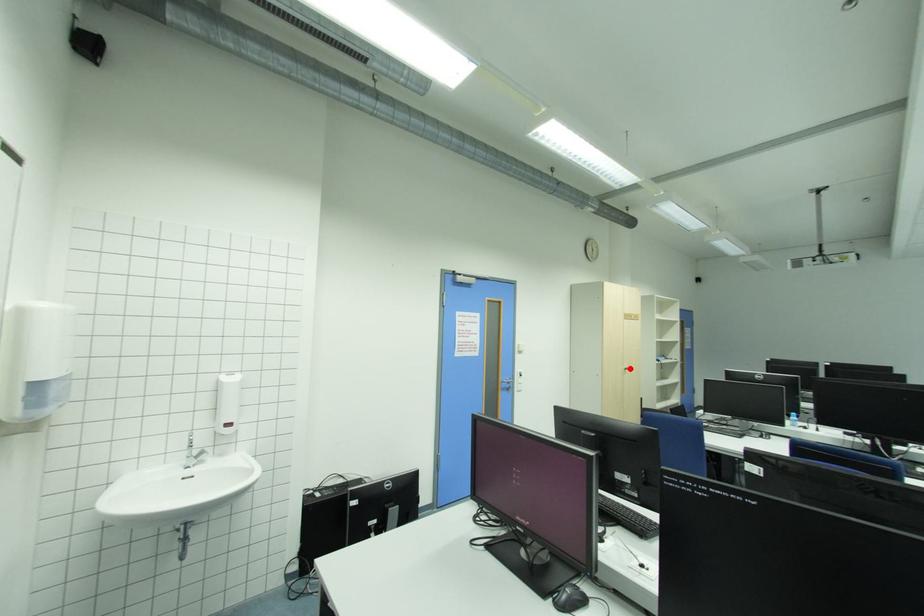
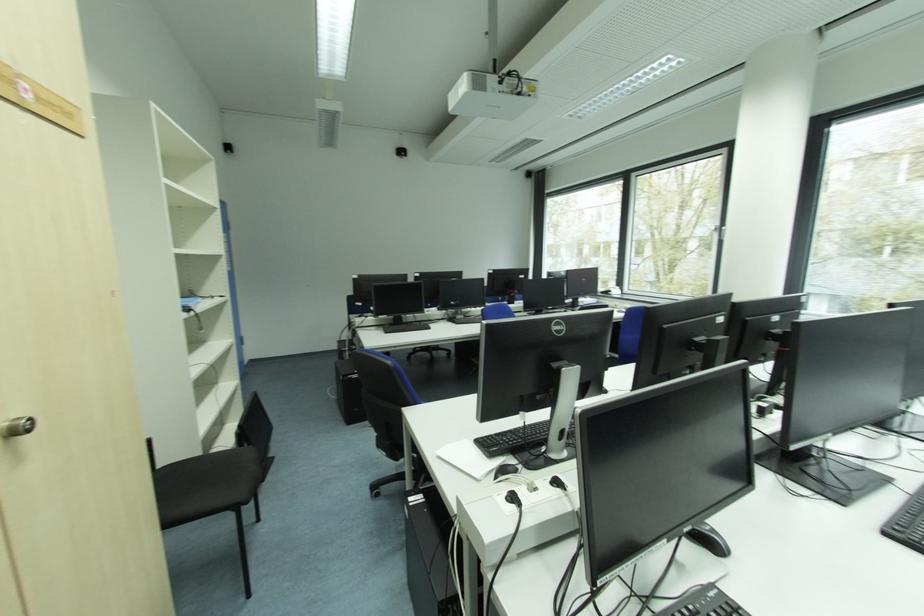
Locate, in the second image, the point that corresponds to the highlighted location in the first image.

(6, 424)